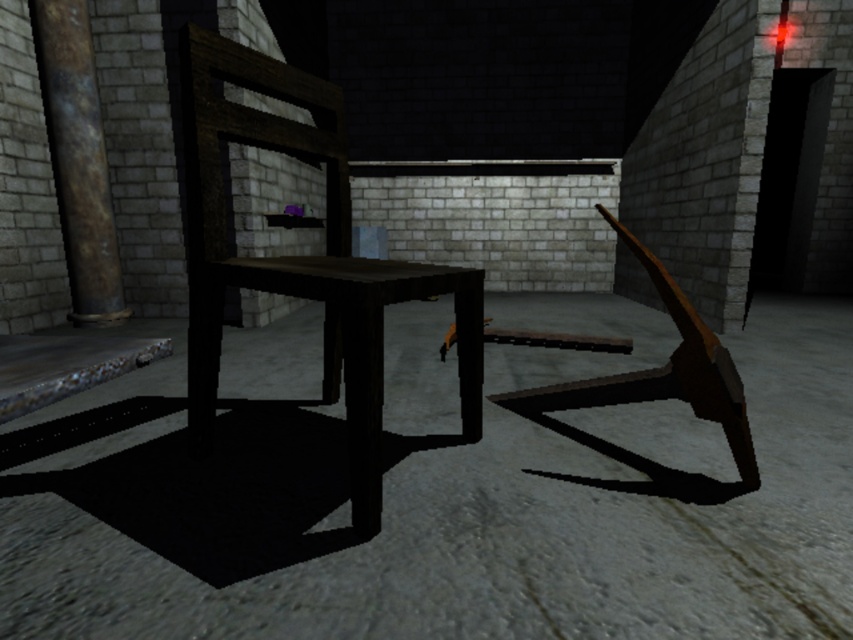
In the scene shown: Between wooden chair at center and rusty metal pillar at left, which one has less height?

wooden chair at center

From the picture: Is wooden chair at center shorter than rusty metal pillar at left?

Correct, wooden chair at center is not as tall as rusty metal pillar at left.

At what (x,y) coordinates should I click in order to perform the action: click on wooden chair at center. Please return your answer as a coordinate pair (x, y). The image size is (853, 640). Looking at the image, I should click on (302, 259).